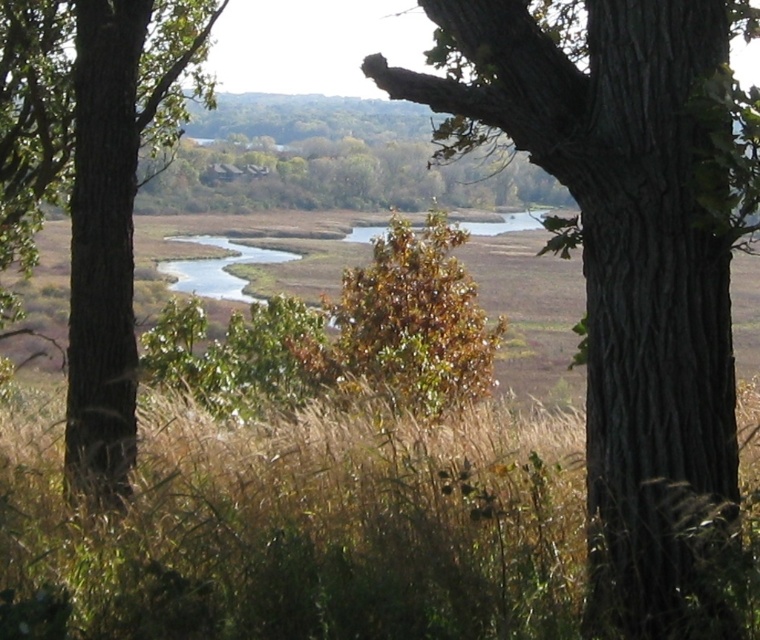
You are a hiker trying to cross the river using the brown grass at center and the brown rough tree trunk at left as landmarks. Which landmark is taller?

The brown rough tree trunk at left is taller than the brown grass at center.